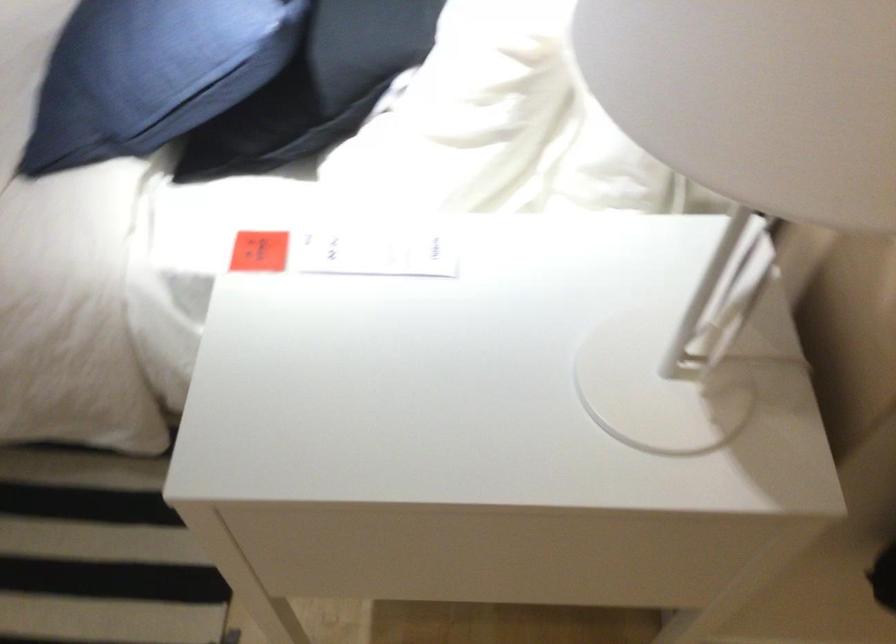
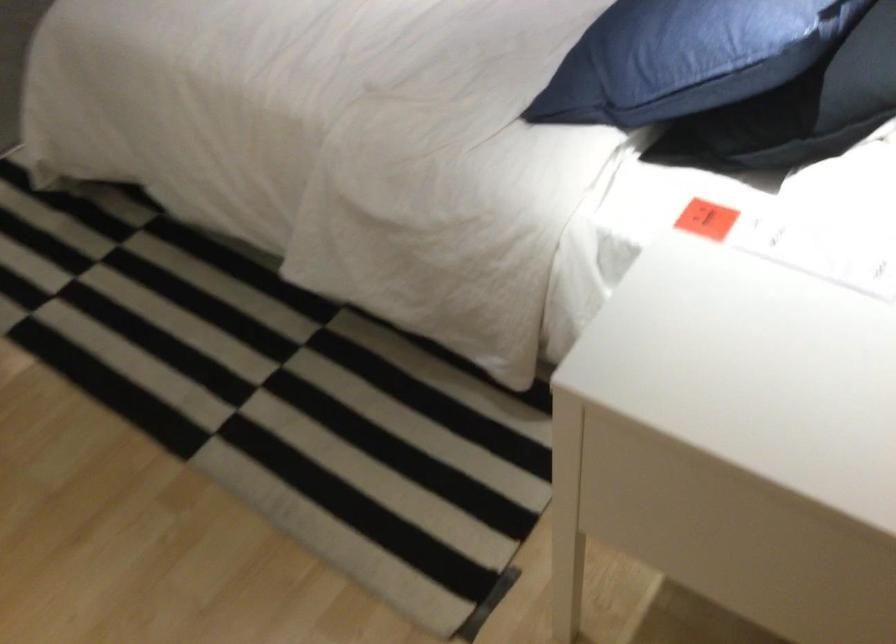
Question: Based on the continuous images, in which direction is the camera rotating? Reply with the corresponding letter.

Choices:
 (A) Left
 (B) Right
 (C) Up
 (D) Down

Answer: (A)